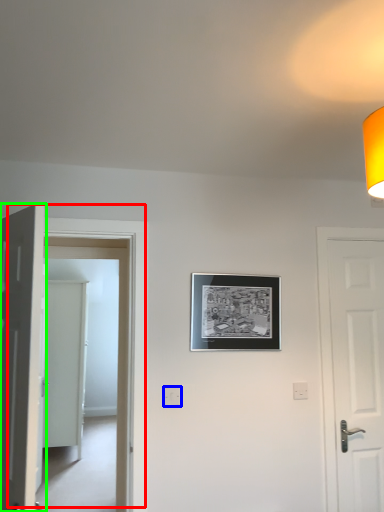
Question: Considering the real-world distances, which object is farthest from door (highlighted by a red box)? electric outlet (highlighted by a blue box) or door (highlighted by a green box)?

Choices:
 (A) electric outlet
 (B) door

Answer: (B)